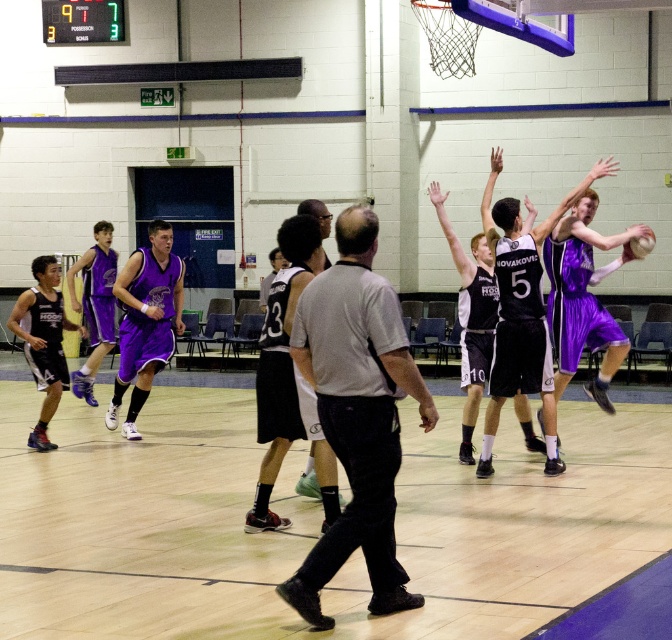
Question: Which object is the farthest from the gray shirt at center?

Choices:
 (A) purple matte basketball at center
 (B) rubber textured basketball at center

Answer: (A)

Question: Is purple matte basketball at center closer to the viewer compared to rubber textured basketball at center?

Choices:
 (A) no
 (B) yes

Answer: (A)

Question: Can you confirm if gray shirt at center is wider than purple matte basketball at center?

Choices:
 (A) no
 (B) yes

Answer: (A)

Question: Which point is farther to the camera?

Choices:
 (A) gray shirt at center
 (B) rubber textured basketball at center

Answer: (B)

Question: Is wooden floor at center positioned at the back of gray shirt at center?

Choices:
 (A) no
 (B) yes

Answer: (B)

Question: Which object is closer to the camera taking this photo?

Choices:
 (A) gray shirt at center
 (B) purple matte basketball at center

Answer: (A)